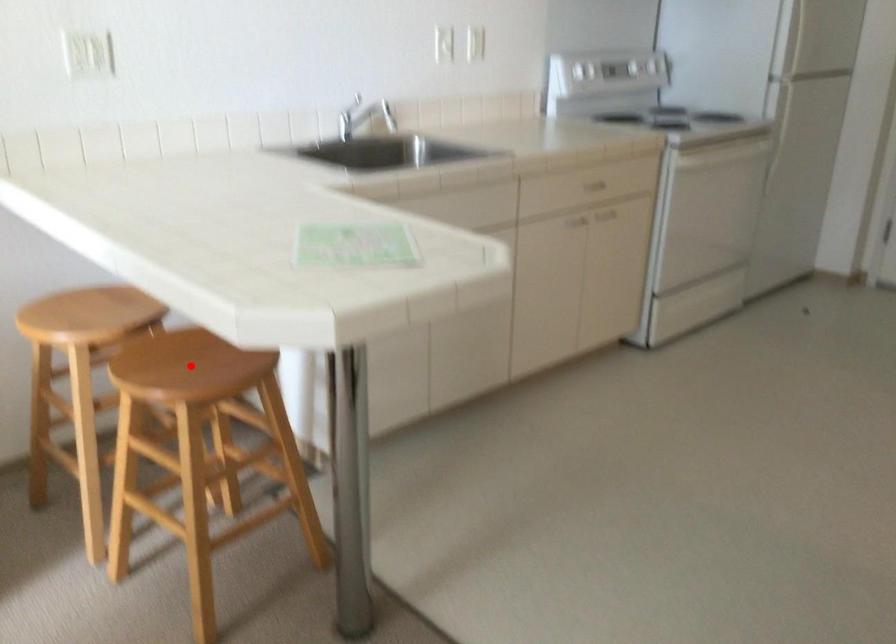
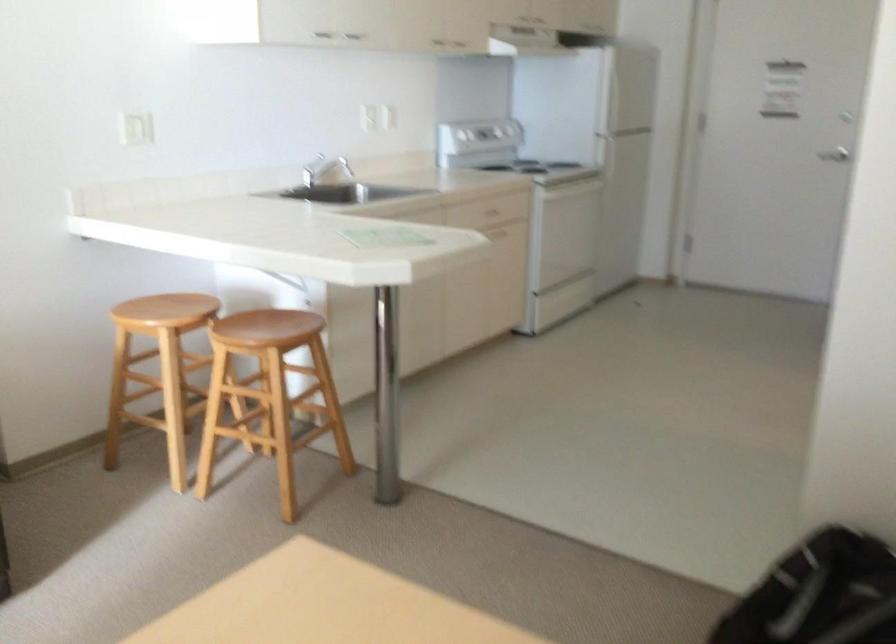
The point at the highlighted location is marked in the first image. Where is the corresponding point in the second image?

(268, 327)